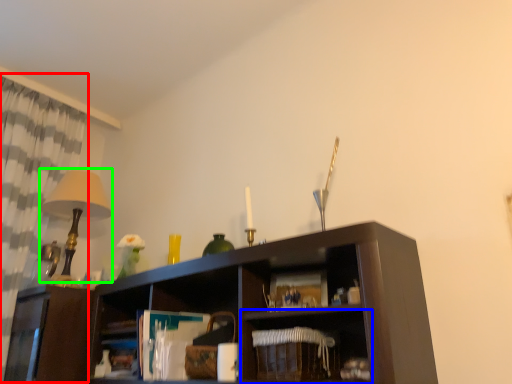
Question: Estimate the real-world distances between objects in this image. Which object is farther from curtain (highlighted by a red box), shelf (highlighted by a blue box) or table lamp (highlighted by a green box)?

Choices:
 (A) shelf
 (B) table lamp

Answer: (A)